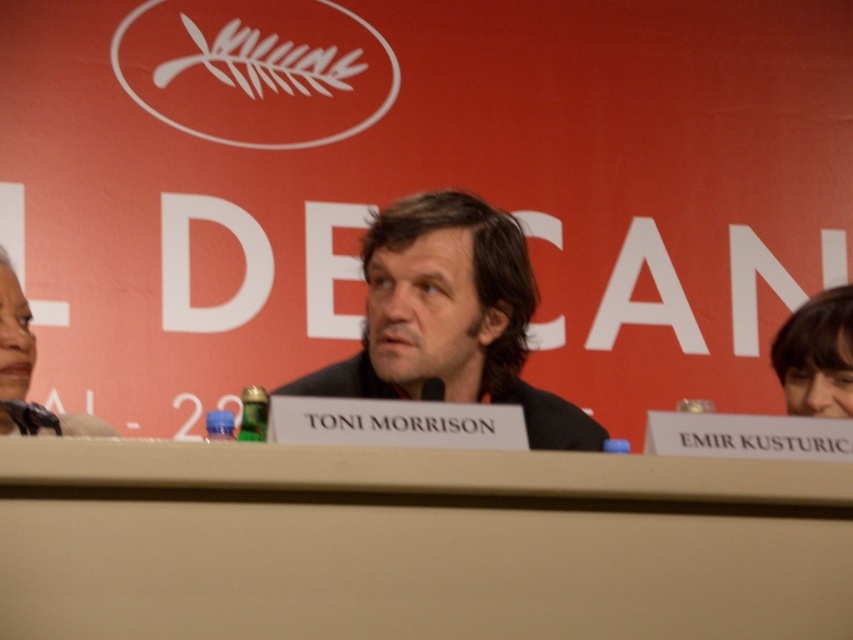
You are organizing a panel discussion and need to ensure that the beige plastic table at center can accommodate a large projector. Considering the size of the matte black hair at left, can you estimate if the table is large enough?

The beige plastic table at center is bigger than the matte black hair at left, so it is likely large enough to accommodate the projector.

You are organizing a panel discussion and need to place a nameplate for the moderator. The nameplate is 10 cm wide. Can the beige plastic table at center accommodate it without overlapping the smooth brown hair at upper right?

The beige plastic table at center has a larger size compared to smooth brown hair at upper right, so the 10 cm wide nameplate can be placed on the table without overlapping the hair.

Based on the scene description, what object is located at the coordinate point (415, 544)?

The beige plastic table at center is located at the coordinate point (415, 544).